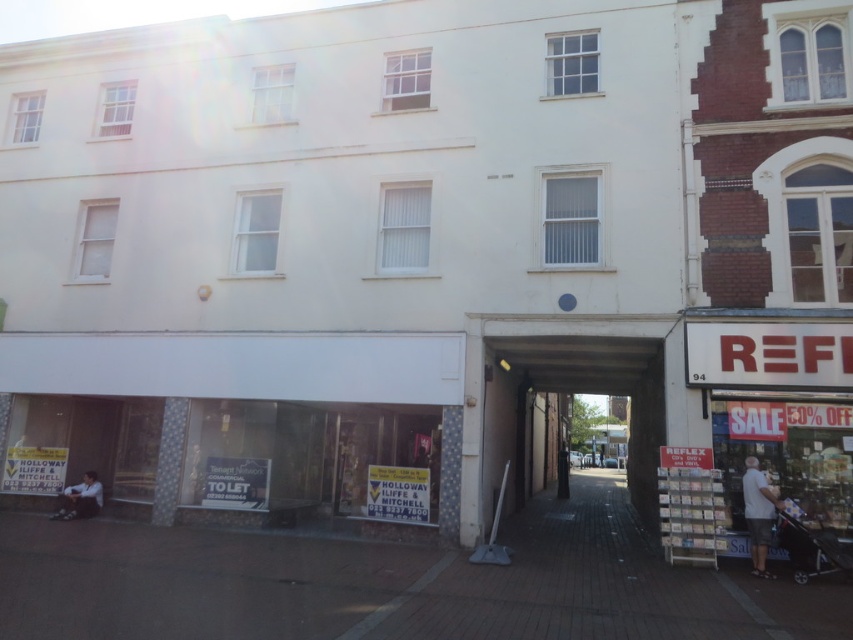
You are a delivery person trying to reach the vacant shop entrance. You see the white cotton shirt at lower right and dark gray jeans at lower left. Which clothing item is closer to you?

The white cotton shirt at lower right is closer to the viewer than dark gray jeans at lower left.